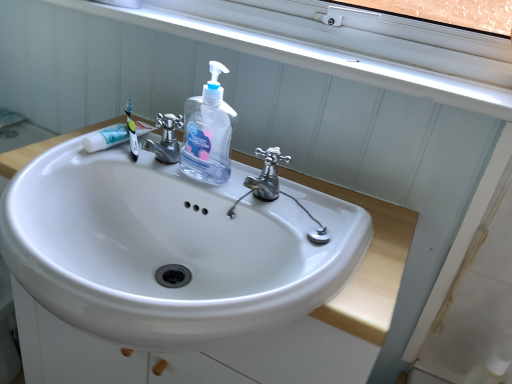
At what (x,y) coordinates should I click in order to perform the action: click on free space in front of black plastic toothbrush at upper left. Please return your answer as a coordinate pair (x, y). The width and height of the screenshot is (512, 384). Looking at the image, I should click on (90, 165).